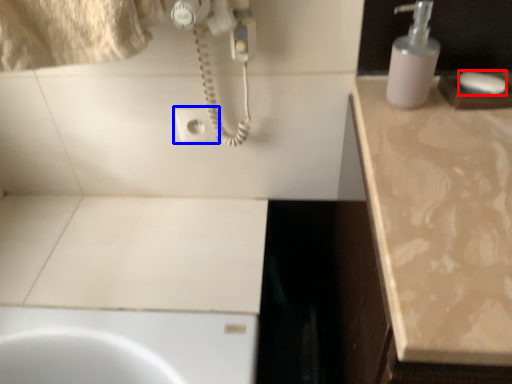
Question: Which of the following is the farthest to the observer, soap (highlighted by a red box) or electric outlet (highlighted by a blue box)?

Choices:
 (A) soap
 (B) electric outlet

Answer: (B)